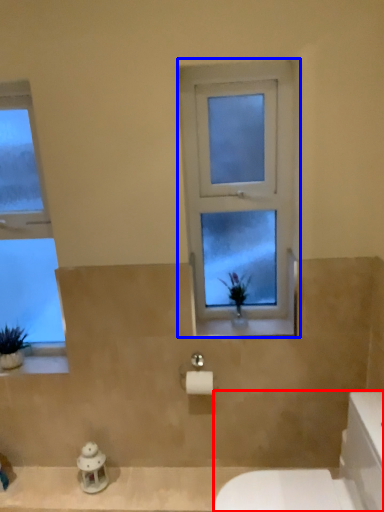
Question: Which object appears farthest to the camera in this image, porcelain (highlighted by a red box) or window (highlighted by a blue box)?

Choices:
 (A) porcelain
 (B) window

Answer: (B)